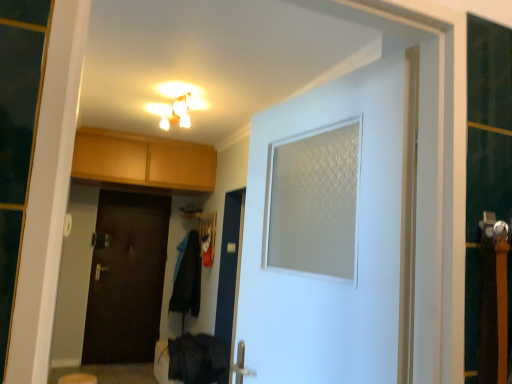
Question: Considering the relative sizes of black fabric coat at center, which is the second laundry from bottom to top, and beige fabric step stool at lower left in the image provided, is black fabric coat at center, which is the second laundry from bottom to top, thinner than beige fabric step stool at lower left?

Choices:
 (A) yes
 (B) no

Answer: (B)

Question: From the image's perspective, is black fabric coat at center, which is the second laundry from bottom to top, located above beige fabric step stool at lower left?

Choices:
 (A) yes
 (B) no

Answer: (A)

Question: Is black fabric coat at center, the 1th laundry positioned from the back, looking in the opposite direction of beige fabric step stool at lower left?

Choices:
 (A) yes
 (B) no

Answer: (B)

Question: Is black fabric coat at center, which is the 1th laundry in top-to-bottom order, surrounding beige fabric step stool at lower left?

Choices:
 (A) yes
 (B) no

Answer: (B)

Question: Would you say dark wood door at center, positioned as the 1th door in back-to-front order, is inside or outside light brown wood cabinets at upper left?

Choices:
 (A) outside
 (B) inside

Answer: (A)

Question: Considering the positions of dark wood door at center, positioned as the 1th door in back-to-front order, and light brown wood cabinets at upper left in the image, is dark wood door at center, positioned as the 1th door in back-to-front order, bigger or smaller than light brown wood cabinets at upper left?

Choices:
 (A) big
 (B) small

Answer: (B)

Question: Would you say dark wood door at center, which appears as the second door when viewed from the right, is to the left or to the right of light brown wood cabinets at upper left in the picture?

Choices:
 (A) left
 (B) right

Answer: (A)

Question: Considering the positions of dark wood door at center, positioned as the 1th door in back-to-front order, and light brown wood cabinets at upper left in the image, is dark wood door at center, positioned as the 1th door in back-to-front order, taller or shorter than light brown wood cabinets at upper left?

Choices:
 (A) tall
 (B) short

Answer: (A)

Question: Considering their positions, is light brown wood cabinets at upper left located in front of or behind matte white light fixture at upper center?

Choices:
 (A) front
 (B) behind

Answer: (B)

Question: Is light brown wood cabinets at upper left inside or outside of matte white light fixture at upper center?

Choices:
 (A) inside
 (B) outside

Answer: (B)

Question: Considering the positions of point (79, 170) and point (172, 107), is point (79, 170) closer or farther from the camera than point (172, 107)?

Choices:
 (A) farther
 (B) closer

Answer: (A)

Question: Considering the positions of light brown wood cabinets at upper left and matte white light fixture at upper center in the image, is light brown wood cabinets at upper left taller or shorter than matte white light fixture at upper center?

Choices:
 (A) short
 (B) tall

Answer: (B)

Question: Based on their sizes in the image, would you say dark fabric laundry at lower center, the 2th laundry from the top, is bigger or smaller than matte white light fixture at upper center?

Choices:
 (A) small
 (B) big

Answer: (B)

Question: From the image's perspective, is dark fabric laundry at lower center, the second laundry when ordered from back to front, above or below matte white light fixture at upper center?

Choices:
 (A) above
 (B) below

Answer: (B)